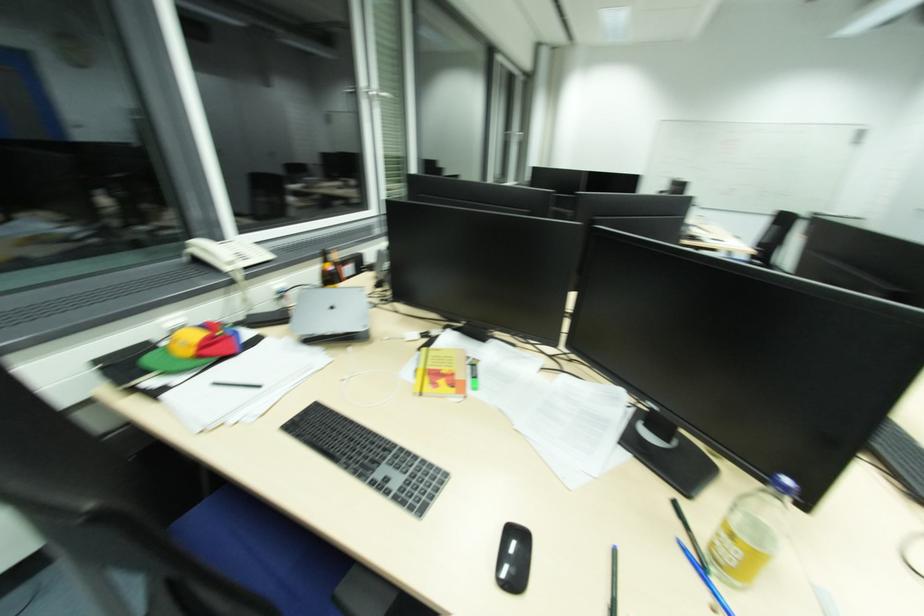
Where is `black chair armrest`? The width and height of the screenshot is (924, 616). black chair armrest is located at coordinates (164, 464).